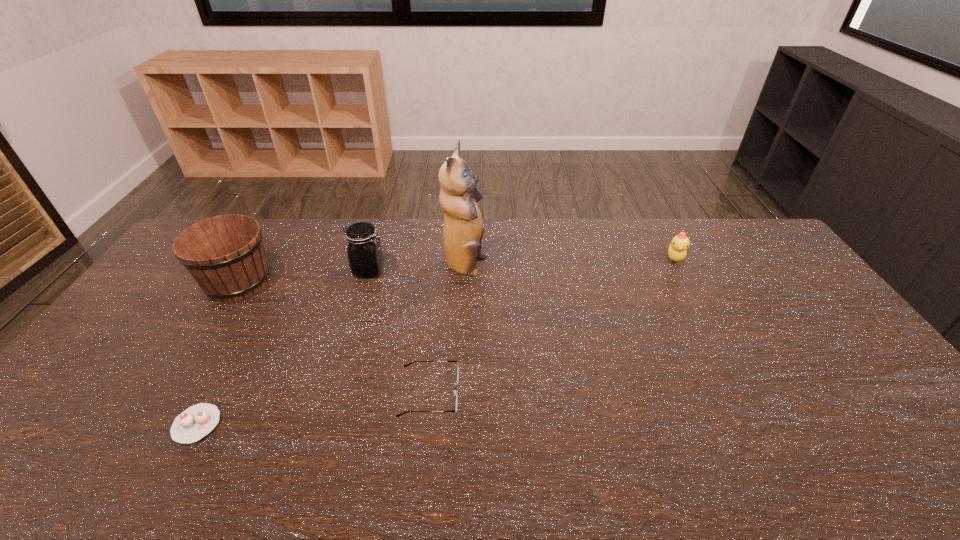
You are a GUI agent. You are given a task and a screenshot of the screen. Output one action in this format:
    pyautogui.click(x=<x>, y=<y>)
    Task: Click on the free area in between the shortest object and the rightmost object
    This screenshot has width=960, height=540.
    Given the screenshot: What is the action you would take?
    pyautogui.click(x=436, y=341)

The height and width of the screenshot is (540, 960). Find the location of `the second closest object relative to the wine bucket`. the second closest object relative to the wine bucket is located at coordinates (194, 423).

Identify the location of the third closest object to the tallest object. The width and height of the screenshot is (960, 540). (225, 254).

This screenshot has height=540, width=960. I want to click on free location that satisfies the following two spatial constraints: 1. on the front-facing side of the rightmost object; 2. on the face of the cat, so click(679, 267).

Identify the location of blank space that satisfies the following two spatial constraints: 1. on the front-facing side of the rightmost object; 2. on the lenses of the spectacles. The image size is (960, 540). (746, 393).

This screenshot has width=960, height=540. I want to click on vacant area in the image that satisfies the following two spatial constraints: 1. on the front-facing side of the fourth tallest object; 2. on the lenses of the spectacles, so click(x=746, y=393).